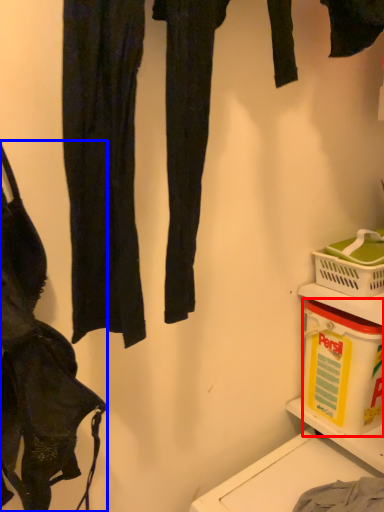
Question: Which object appears closest to the camera in this image, box (highlighted by a red box) or handbag (highlighted by a blue box)?

Choices:
 (A) box
 (B) handbag

Answer: (B)